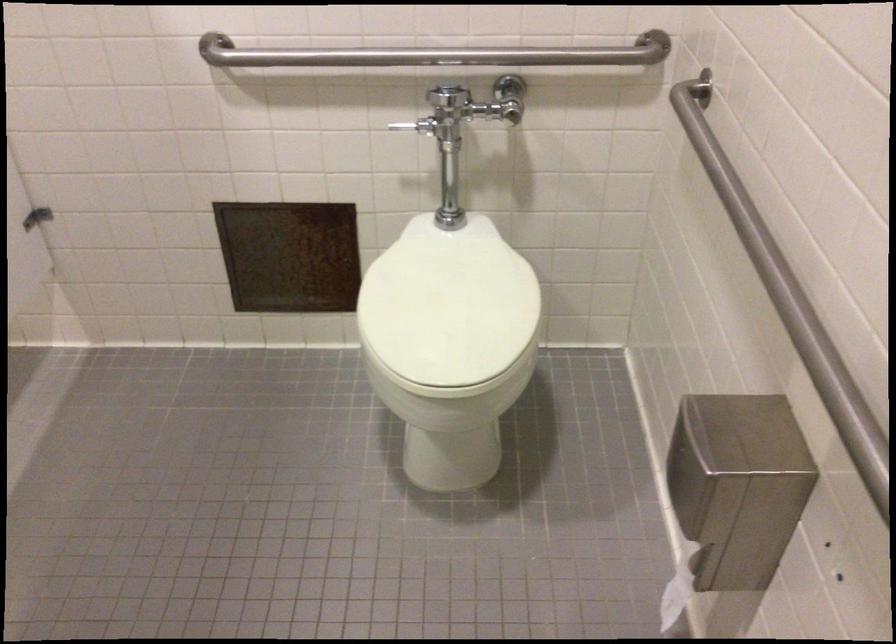
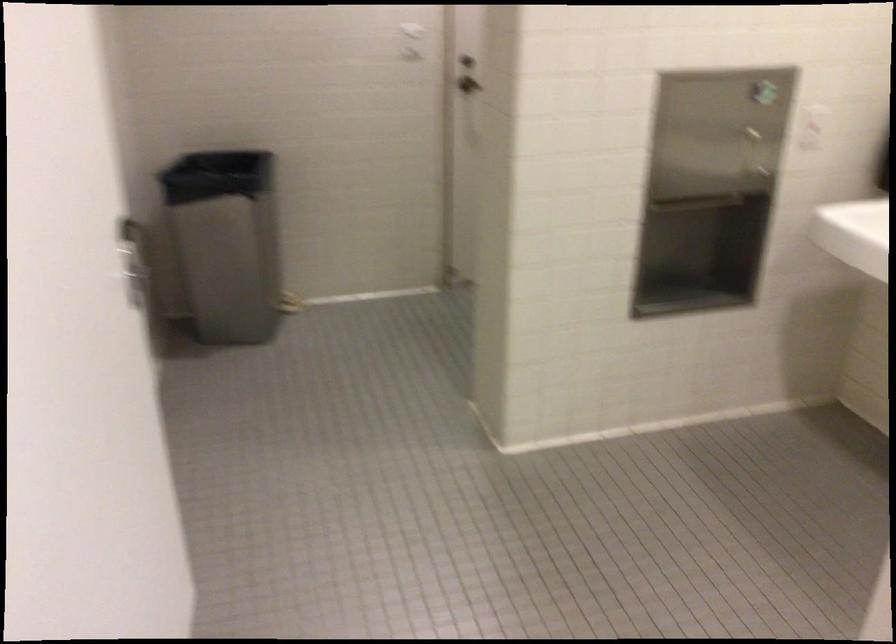
Question: The images are taken continuously from a first-person perspective. In which direction is your viewpoint rotating?

Choices:
 (A) Left
 (B) Right
 (C) Up
 (D) Down

Answer: (A)